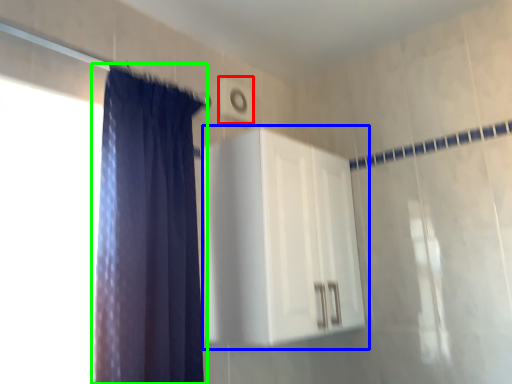
Question: Based on their relative distances, which object is nearer to light switch (highlighted by a red box)? Choose from dresser (highlighted by a blue box) and curtain (highlighted by a green box).

Choices:
 (A) dresser
 (B) curtain

Answer: (A)